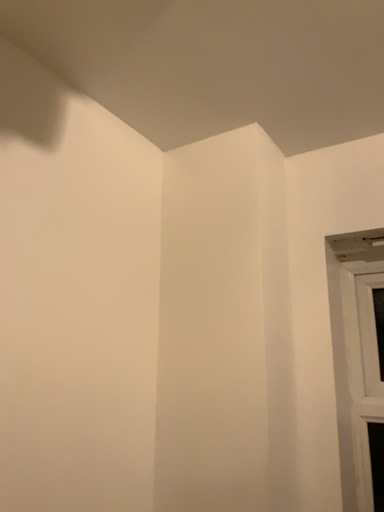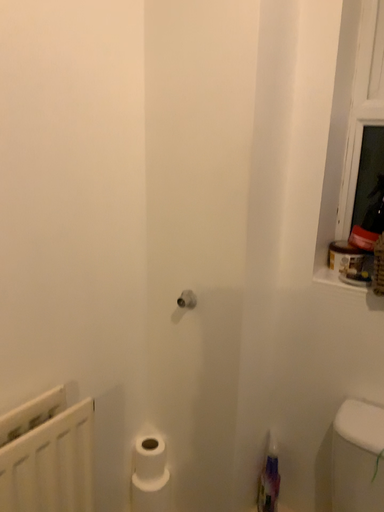
Question: Which way did the camera rotate in the video?

Choices:
 (A) rotated upward
 (B) rotated downward

Answer: (B)